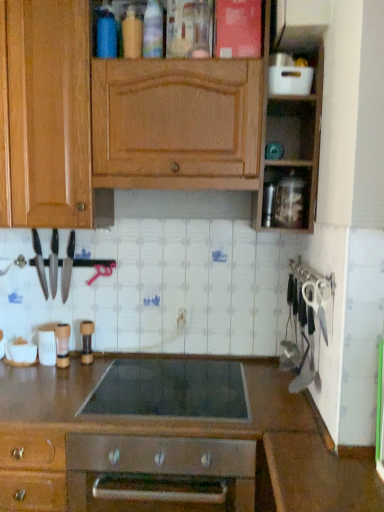
What do you see at coordinates (54, 262) in the screenshot? I see `black plastic knife at left, arranged as the second kitchen appliance when viewed from the left` at bounding box center [54, 262].

What is the approximate width of white plastic container at upper right, positioned as the 1th appliance in right-to-left order?

It is 12.48 centimeters.

The image size is (384, 512). I want to click on white plastic container at lower left, which is the second appliance in left-to-right order, so click(x=46, y=344).

Image resolution: width=384 pixels, height=512 pixels. What do you see at coordinates (46, 344) in the screenshot?
I see `white plastic container at lower left, which ranks as the 5th appliance in top-to-bottom order` at bounding box center [46, 344].

Where is `black glass cooktop at center`? This screenshot has height=512, width=384. black glass cooktop at center is located at coordinates [x=170, y=390].

This screenshot has height=512, width=384. Describe the element at coordinates (170, 390) in the screenshot. I see `black glass cooktop at center` at that location.

Describe the element at coordinates (290, 200) in the screenshot. I see `transparent plastic container at upper right, acting as the 5th appliance starting from the left` at that location.

In order to click on white plastic scissors at right in this screenshot , I will do `click(318, 301)`.

This screenshot has height=512, width=384. Find the location of `clear plastic container at lower left, the 3th appliance when ordered from left to right`. clear plastic container at lower left, the 3th appliance when ordered from left to right is located at coordinates (62, 345).

In order to click on black plastic knife at left, arranged as the second kitchen appliance when viewed from the left in this screenshot , I will do tap(54, 262).

Between transparent plastic container at upper right, the second appliance viewed from the right, and black glass cooktop at center, which one has smaller width?

transparent plastic container at upper right, the second appliance viewed from the right, is thinner.

Do you think transparent plastic container at upper right, which appears as the fifth appliance when ordered from the bottom, is within black glass cooktop at center, or outside of it?

transparent plastic container at upper right, which appears as the fifth appliance when ordered from the bottom, is outside black glass cooktop at center.

Is transparent plastic container at upper right, which appears as the fifth appliance when ordered from the bottom, touching black glass cooktop at center?

There is a gap between transparent plastic container at upper right, which appears as the fifth appliance when ordered from the bottom, and black glass cooktop at center.

From the picture: Is transparent plastic container at upper right, which appears as the fifth appliance when ordered from the bottom, shorter than black glass cooktop at center?

No, transparent plastic container at upper right, which appears as the fifth appliance when ordered from the bottom, is not shorter than black glass cooktop at center.

Considering the sizes of objects wooden cabinet at upper center and black plastic knife at left, positioned as the 2th kitchen appliance in right-to-left order, in the image provided, who is taller, wooden cabinet at upper center or black plastic knife at left, positioned as the 2th kitchen appliance in right-to-left order,?

wooden cabinet at upper center is taller.

What's the angular difference between wooden cabinet at upper center and black plastic knife at left, arranged as the second kitchen appliance when viewed from the left,'s facing directions?

2.34 degrees separate the facing orientations of wooden cabinet at upper center and black plastic knife at left, arranged as the second kitchen appliance when viewed from the left.

Between wooden cabinet at upper center and black plastic knife at left, arranged as the second kitchen appliance when viewed from the left, which one has smaller width?

black plastic knife at left, arranged as the second kitchen appliance when viewed from the left, is thinner.

Is wooden cabinet at upper center turned away from black plastic knife at left, positioned as the 2th kitchen appliance in right-to-left order?

No.

Which object is positioned more to the left, white plastic container at lower left, which is the second appliance in left-to-right order, or brown matte pepper grinder at center, which appears as the fourth appliance when viewed from the left?

From the viewer's perspective, white plastic container at lower left, which is the second appliance in left-to-right order, appears more on the left side.

Would you consider white plastic container at lower left, which is the 5th appliance in right-to-left order, to be distant from brown matte pepper grinder at center, placed as the third appliance when sorted from top to bottom?

No.

Looking at this image, is white plastic container at lower left, which is the 5th appliance in right-to-left order, inside or outside of brown matte pepper grinder at center, which is the fourth appliance from bottom to top?

white plastic container at lower left, which is the 5th appliance in right-to-left order, is located beyond the bounds of brown matte pepper grinder at center, which is the fourth appliance from bottom to top.

From a real-world perspective, does white plastic container at lower left, which is the second appliance in left-to-right order, sit lower than brown matte pepper grinder at center, marked as the 3th appliance in a right-to-left arrangement?

Correct, in the physical world, white plastic container at lower left, which is the second appliance in left-to-right order, is lower than brown matte pepper grinder at center, marked as the 3th appliance in a right-to-left arrangement.

Is polished stainless steel knives at left, the 3th kitchen appliance positioned from the left, taller or shorter than white glossy bowl at lower left, the sixth appliance viewed from the right?

Clearly, polished stainless steel knives at left, the 3th kitchen appliance positioned from the left, is taller compared to white glossy bowl at lower left, the sixth appliance viewed from the right.

Is polished stainless steel knives at left, the first kitchen appliance viewed from the right, further to camera compared to white glossy bowl at lower left, which ranks as the sixth appliance in top-to-bottom order?

Yes.

Which object is thinner, polished stainless steel knives at left, the 3th kitchen appliance positioned from the left, or white glossy bowl at lower left, acting as the first appliance starting from the left?

Thinner between the two is polished stainless steel knives at left, the 3th kitchen appliance positioned from the left.

Is point (69, 274) positioned before point (18, 350)?

That is False.

At what (x,y) coordinates should I click in order to perform the action: click on cabinetry above the white glossy bowl at lower left, the sixth appliance viewed from the right (from the image's perspective). Please return your answer as a coordinate pair (x, y). This screenshot has height=512, width=384. Looking at the image, I should click on (137, 121).

Does white glossy bowl at lower left, which ranks as the sixth appliance in top-to-bottom order, have a lesser width compared to wooden cabinet at upper center?

Yes, white glossy bowl at lower left, which ranks as the sixth appliance in top-to-bottom order, is thinner than wooden cabinet at upper center.

Does white glossy bowl at lower left, acting as the first appliance starting from the left, have a greater height compared to wooden cabinet at upper center?

In fact, white glossy bowl at lower left, acting as the first appliance starting from the left, may be shorter than wooden cabinet at upper center.

Could you tell me if white glossy bowl at lower left, the sixth appliance viewed from the right, is turned towards wooden cabinet at upper center?

No.

Which is more to the right, wooden cabinet at upper center or transparent plastic container at upper right, acting as the 5th appliance starting from the left?

transparent plastic container at upper right, acting as the 5th appliance starting from the left.

How far apart are wooden cabinet at upper center and transparent plastic container at upper right, acting as the 5th appliance starting from the left?

wooden cabinet at upper center and transparent plastic container at upper right, acting as the 5th appliance starting from the left, are 19.30 inches apart.

From a real-world perspective, which is physically below, wooden cabinet at upper center or transparent plastic container at upper right, acting as the 5th appliance starting from the left?

From a 3D spatial view, transparent plastic container at upper right, acting as the 5th appliance starting from the left, is below.

Do you think wooden cabinet at upper center is within transparent plastic container at upper right, the second appliance viewed from the right, or outside of it?

wooden cabinet at upper center is not enclosed by transparent plastic container at upper right, the second appliance viewed from the right.

Considering the relative sizes of brown matte pepper grinder at center, which is the fourth appliance from bottom to top, and white glossy bowl at lower left, the sixth appliance viewed from the right, in the image provided, is brown matte pepper grinder at center, which is the fourth appliance from bottom to top, shorter than white glossy bowl at lower left, the sixth appliance viewed from the right,?

Incorrect, the height of brown matte pepper grinder at center, which is the fourth appliance from bottom to top, does not fall short of that of white glossy bowl at lower left, the sixth appliance viewed from the right.

From the image's perspective, is brown matte pepper grinder at center, which is the fourth appliance from bottom to top, located above white glossy bowl at lower left, which is the 1th appliance in bottom-to-top order?

Yes, from the image's perspective, brown matte pepper grinder at center, which is the fourth appliance from bottom to top, is over white glossy bowl at lower left, which is the 1th appliance in bottom-to-top order.

Who is bigger, brown matte pepper grinder at center, marked as the 3th appliance in a right-to-left arrangement, or white glossy bowl at lower left, the sixth appliance viewed from the right?

With larger size is white glossy bowl at lower left, the sixth appliance viewed from the right.

From the picture: Which object is more forward, brown matte pepper grinder at center, marked as the 3th appliance in a right-to-left arrangement, or white glossy bowl at lower left, which ranks as the sixth appliance in top-to-bottom order?

Positioned in front is white glossy bowl at lower left, which ranks as the sixth appliance in top-to-bottom order.

There is a black glass cooktop at center. In order to click on the 5th appliance above it (from a real-world perspective) in this screenshot , I will do `click(290, 200)`.

Locate an element on the screen. Image resolution: width=384 pixels, height=512 pixels. cabinetry on the right side of black plastic knife at left, arranged as the second kitchen appliance when viewed from the left is located at coordinates (137, 121).

Consider the image. Which object lies nearer to the anchor point brown polished countertop at center, white plastic container at lower left, which ranks as the 5th appliance in top-to-bottom order, or white glossy bowl at lower left, which is the 1th appliance in bottom-to-top order?

Among the two, white plastic container at lower left, which ranks as the 5th appliance in top-to-bottom order, is located nearer to brown polished countertop at center.

When comparing their distances from white plastic container at lower left, which is the 5th appliance in right-to-left order, does polished stainless steel knives at left, the first kitchen appliance viewed from the right, or white glossy bowl at lower left, which is the 1th appliance in bottom-to-top order, seem further?

Based on the image, polished stainless steel knives at left, the first kitchen appliance viewed from the right, appears to be further to white plastic container at lower left, which is the 5th appliance in right-to-left order.

Based on their spatial positions, is white plastic scissors at right or white plastic container at lower left, which is counted as the second appliance, starting from the bottom, closer to brown polished countertop at center?

white plastic scissors at right lies closer to brown polished countertop at center than the other object.

From the image, which object appears to be nearer to transparent plastic container at upper right, the second appliance viewed from the right, white plastic container at lower left, which is counted as the second appliance, starting from the bottom, or black metal knife at left, which ranks as the first kitchen appliance in left-to-right order?

The object closer to transparent plastic container at upper right, the second appliance viewed from the right, is black metal knife at left, which ranks as the first kitchen appliance in left-to-right order.

Which object lies nearer to the anchor point white plastic scissors at right, clear plastic container at lower left, the 3th appliance when ordered from left to right, or transparent plastic container at upper right, acting as the 5th appliance starting from the left?

Among the two, transparent plastic container at upper right, acting as the 5th appliance starting from the left, is located nearer to white plastic scissors at right.

Looking at the image, which one is located closer to brown polished countertop at center, black metal knife at left, which ranks as the first kitchen appliance in left-to-right order, or white plastic scissors at right?

white plastic scissors at right.

Based on their spatial positions, is clear plastic container at lower left, the third appliance when ordered from bottom to top, or brown matte pepper grinder at center, which appears as the fourth appliance when viewed from the left, closer to black glass cooktop at center?

Based on the image, brown matte pepper grinder at center, which appears as the fourth appliance when viewed from the left, appears to be nearer to black glass cooktop at center.

Consider the image. Looking at the image, which one is located further to black plastic knife at left, arranged as the second kitchen appliance when viewed from the left, polished stainless steel knives at left, the first kitchen appliance viewed from the right, or white plastic container at upper right, marked as the first appliance in a top-to-bottom arrangement?

white plastic container at upper right, marked as the first appliance in a top-to-bottom arrangement, is further to black plastic knife at left, arranged as the second kitchen appliance when viewed from the left.

The image size is (384, 512). Find the location of `gas stove between brown matte pepper grinder at center, marked as the 3th appliance in a right-to-left arrangement, and transparent plastic container at upper right, the second appliance viewed from the right, in the horizontal direction`. gas stove between brown matte pepper grinder at center, marked as the 3th appliance in a right-to-left arrangement, and transparent plastic container at upper right, the second appliance viewed from the right, in the horizontal direction is located at coordinates (170, 390).

This screenshot has height=512, width=384. Identify the location of gas stove situated between black plastic knife at left, positioned as the 2th kitchen appliance in right-to-left order, and white plastic scissors at right from left to right. (170, 390).

The image size is (384, 512). What are the coordinates of `gas stove located between black plastic knife at left, positioned as the 2th kitchen appliance in right-to-left order, and transparent plastic container at upper right, the second appliance viewed from the right, in the left-right direction` in the screenshot? It's located at (170, 390).

Locate an element on the screen. gas stove between polished stainless steel knives at left, the 3th kitchen appliance positioned from the left, and white plastic scissors at right is located at coordinates (170, 390).